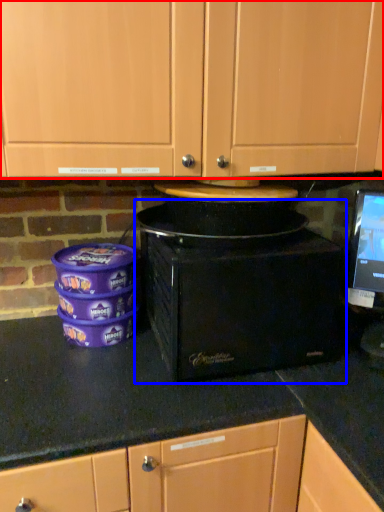
Question: Among these objects, which one is farthest to the camera, cabinetry (highlighted by a red box) or home appliance (highlighted by a blue box)?

Choices:
 (A) cabinetry
 (B) home appliance

Answer: (B)